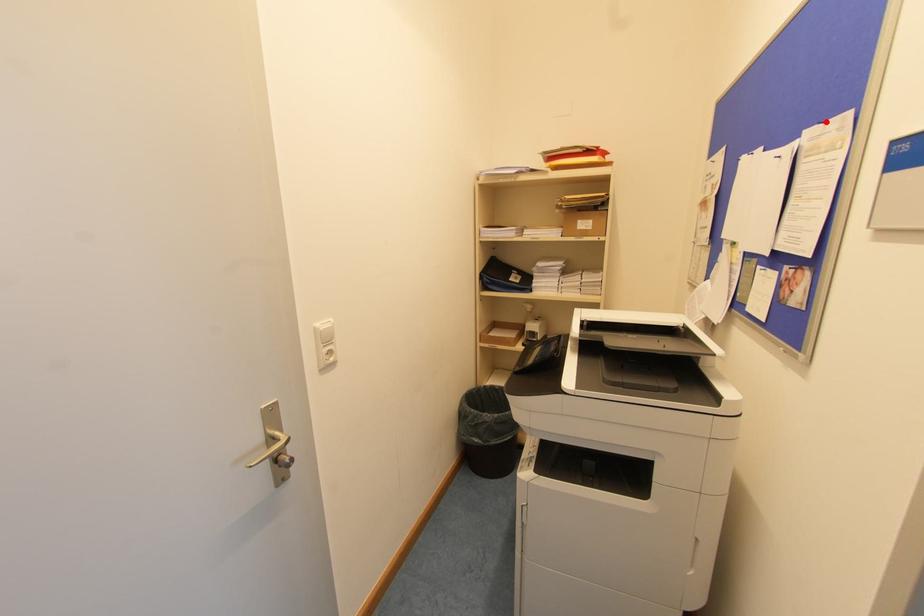
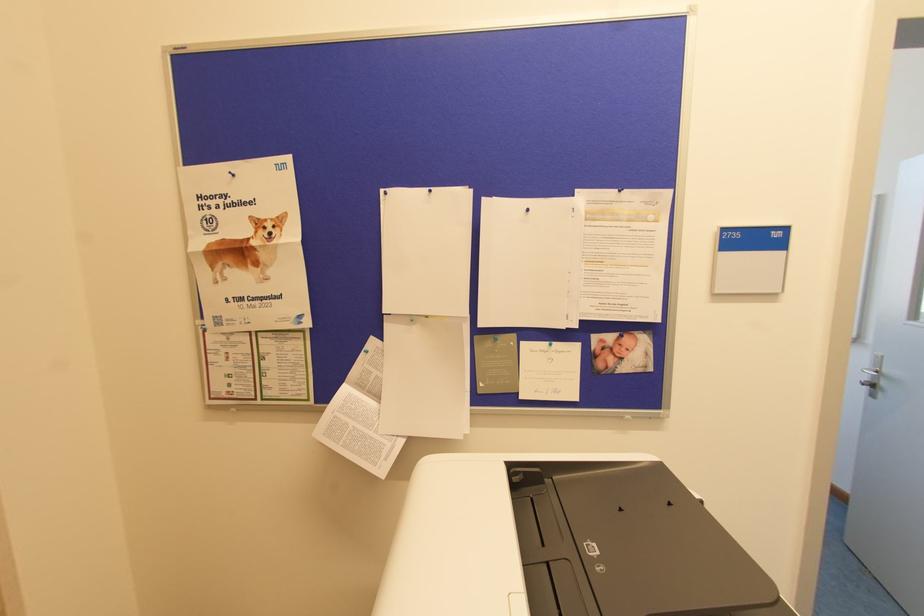
Locate, in the second image, the point that corresponds to the highlighted location in the first image.

(619, 190)